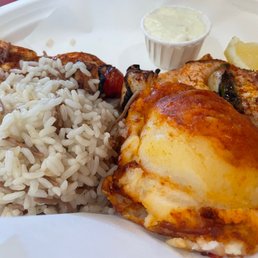
Locate an element on the screen. condiment cup is located at coordinates (172, 55).